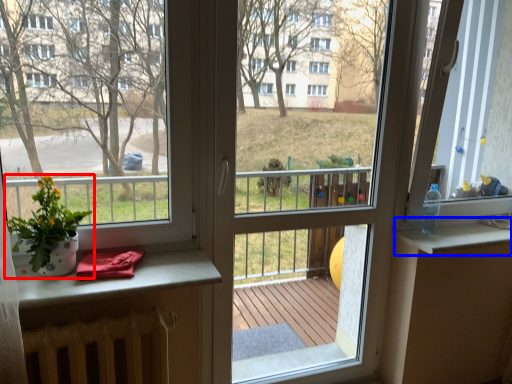
Question: Which point is further to the camera, houseplant (highlighted by a red box) or window sill (highlighted by a blue box)?

Choices:
 (A) houseplant
 (B) window sill

Answer: (B)